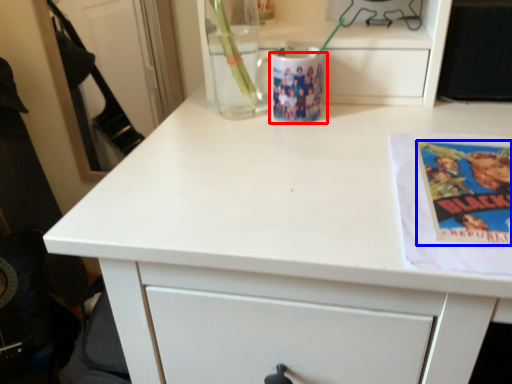
Question: Which point is closer to the camera, mug (highlighted by a red box) or paperback book (highlighted by a blue box)?

Choices:
 (A) mug
 (B) paperback book

Answer: (B)